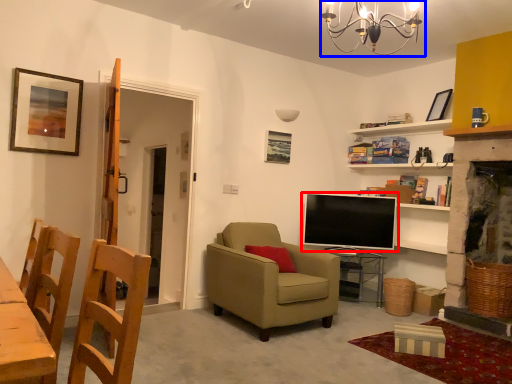
Question: Which object is further to the camera taking this photo, television (highlighted by a red box) or light fixture (highlighted by a blue box)?

Choices:
 (A) television
 (B) light fixture

Answer: (A)